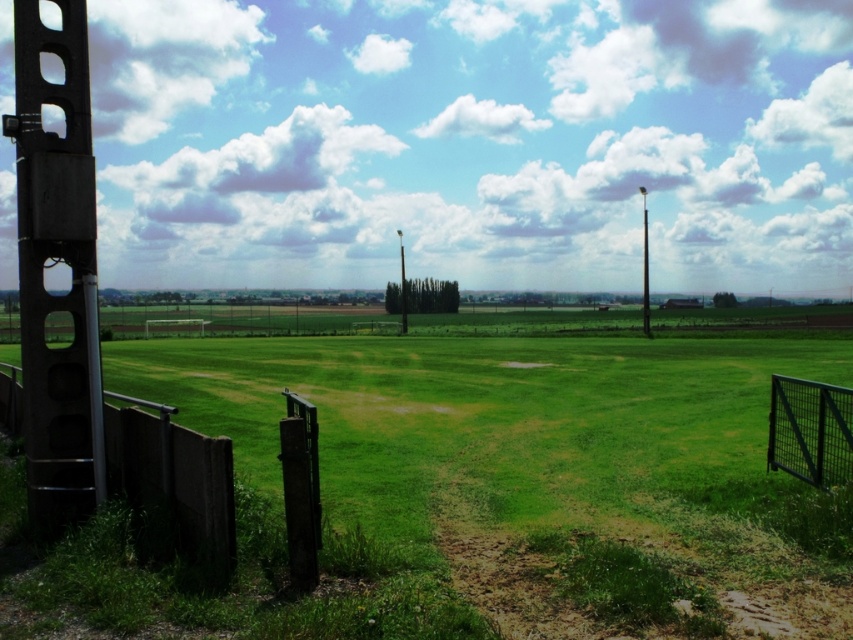
Question: Which object is the farthest from the black wire mesh fence at right?

Choices:
 (A) smooth metal pole at right
 (B) green grass at center
 (C) dark gray concrete fence at lower left

Answer: (A)

Question: Is metallic gray pole at left below smooth metal pole at right?

Choices:
 (A) yes
 (B) no

Answer: (A)

Question: Is green grass at center to the left of smooth metal pole at right from the viewer's perspective?

Choices:
 (A) no
 (B) yes

Answer: (B)

Question: Which point is farther to the camera?

Choices:
 (A) black wire mesh fence at right
 (B) metallic gray pole at left
 (C) dark gray concrete fence at lower left

Answer: (A)

Question: Which of these objects is positioned farthest from the metallic gray pole at left?

Choices:
 (A) green grass at center
 (B) dark gray concrete fence at lower left
 (C) smooth metal pole at right
 (D) black wire mesh fence at right

Answer: (C)

Question: Is metallic gray pole at left further to camera compared to dark gray concrete fence at lower left?

Choices:
 (A) no
 (B) yes

Answer: (B)